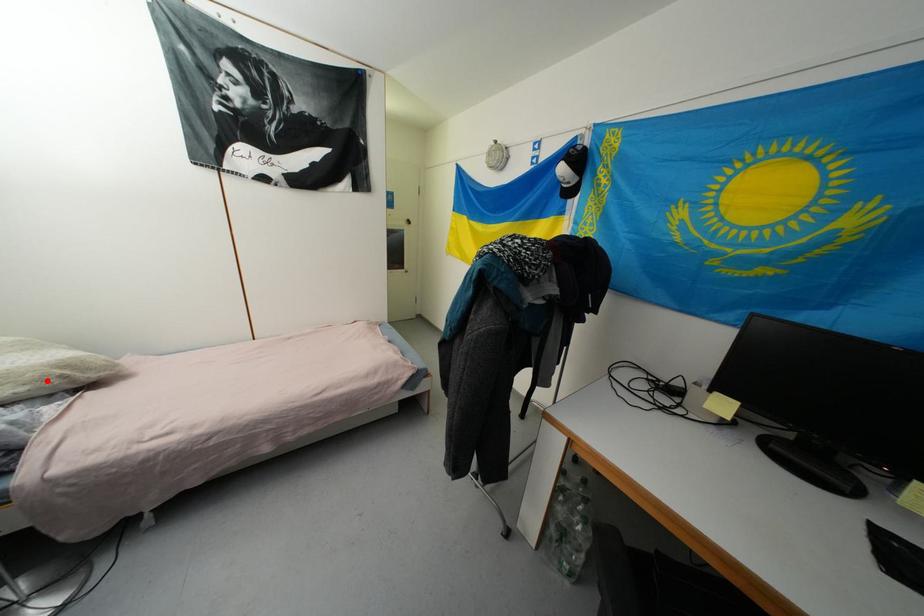
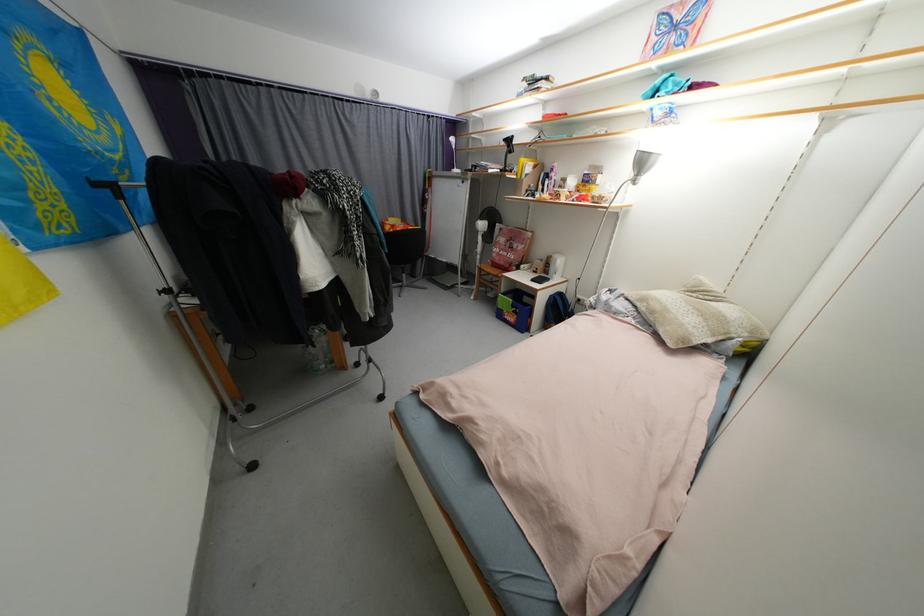
Question: I am providing you with two images of the same scene from different viewpoints. A red point is shown in image1. For the corresponding object point in image2, is it positioned nearer or farther from the camera?

Choices:
 (A) Nearer
 (B) Farther

Answer: (A)